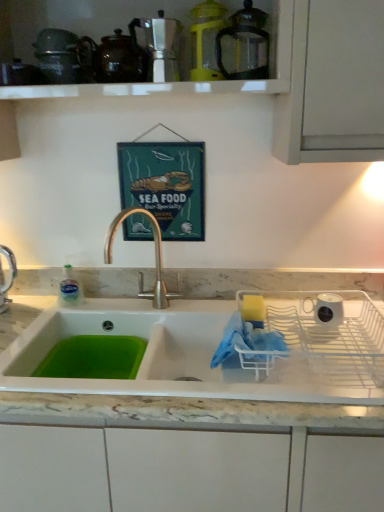
The width and height of the screenshot is (384, 512). Describe the element at coordinates (165, 185) in the screenshot. I see `teal wooden signboard at center` at that location.

Describe the element at coordinates (327, 309) in the screenshot. I see `white ceramic mug at right, the fourth appliance viewed from the top` at that location.

This screenshot has height=512, width=384. Describe the element at coordinates (158, 46) in the screenshot. I see `metallic silver coffee maker at upper center, acting as the fourth appliance starting from the right` at that location.

Where is `teal wooden signboard at center`? teal wooden signboard at center is located at coordinates (165, 185).

Is metallic silver coffee maker at upper center, arranged as the third appliance when viewed from the top, turned away from white ceramic sink at center?

No, metallic silver coffee maker at upper center, arranged as the third appliance when viewed from the top, is not facing away from white ceramic sink at center.

Considering the relative sizes of metallic silver coffee maker at upper center, which ranks as the first appliance in left-to-right order, and white ceramic sink at center in the image provided, is metallic silver coffee maker at upper center, which ranks as the first appliance in left-to-right order, thinner than white ceramic sink at center?

Yes, metallic silver coffee maker at upper center, which ranks as the first appliance in left-to-right order, is thinner than white ceramic sink at center.

In terms of height, does metallic silver coffee maker at upper center, placed as the second appliance when sorted from bottom to top, look taller or shorter compared to white ceramic sink at center?

In the image, metallic silver coffee maker at upper center, placed as the second appliance when sorted from bottom to top, appears to be shorter than white ceramic sink at center.

Is metallic silver coffee maker at upper center, placed as the second appliance when sorted from bottom to top, turned away from teal wooden signboard at center?

No, metallic silver coffee maker at upper center, placed as the second appliance when sorted from bottom to top,'s orientation is not away from teal wooden signboard at center.

Considering the relative sizes of metallic silver coffee maker at upper center, placed as the second appliance when sorted from bottom to top, and teal wooden signboard at center in the image provided, is metallic silver coffee maker at upper center, placed as the second appliance when sorted from bottom to top, bigger than teal wooden signboard at center?

Incorrect, metallic silver coffee maker at upper center, placed as the second appliance when sorted from bottom to top, is not larger than teal wooden signboard at center.

Considering the positions of objects metallic silver coffee maker at upper center, which ranks as the first appliance in left-to-right order, and teal wooden signboard at center in the image provided, who is more to the right, metallic silver coffee maker at upper center, which ranks as the first appliance in left-to-right order, or teal wooden signboard at center?

metallic silver coffee maker at upper center, which ranks as the first appliance in left-to-right order, is more to the right.

Is metallic silver coffee maker at upper center, acting as the fourth appliance starting from the right, oriented away from marble at center?

No, marble at center is not at the back of metallic silver coffee maker at upper center, acting as the fourth appliance starting from the right.

Considering the sizes of objects metallic silver coffee maker at upper center, acting as the fourth appliance starting from the right, and marble at center in the image provided, who is taller, metallic silver coffee maker at upper center, acting as the fourth appliance starting from the right, or marble at center?

With more height is marble at center.

Is metallic silver coffee maker at upper center, acting as the fourth appliance starting from the right, to the right of marble at center from the viewer's perspective?

Incorrect, metallic silver coffee maker at upper center, acting as the fourth appliance starting from the right, is not on the right side of marble at center.

Consider the image. Which of these two, metallic silver coffee maker at upper center, arranged as the third appliance when viewed from the top, or marble at center, is thinner?

With smaller width is metallic silver coffee maker at upper center, arranged as the third appliance when viewed from the top.

Based on the photo, between transparent glass carafe at upper center, which appears as the 2th appliance when viewed from the right, and metallic silver coffee maker at upper center, arranged as the third appliance when viewed from the top, which one appears on the right side from the viewer's perspective?

transparent glass carafe at upper center, which appears as the 2th appliance when viewed from the right.

From the image's perspective, between transparent glass carafe at upper center, which appears as the 2th appliance when viewed from the right, and metallic silver coffee maker at upper center, acting as the fourth appliance starting from the right, which one is located above?

From the image's view, transparent glass carafe at upper center, which appears as the 2th appliance when viewed from the right, is above.

Is transparent glass carafe at upper center, placed as the second appliance when sorted from top to bottom, further to camera compared to metallic silver coffee maker at upper center, arranged as the third appliance when viewed from the top?

No, transparent glass carafe at upper center, placed as the second appliance when sorted from top to bottom, is closer to the viewer.

From a real-world perspective, is transparent glass carafe at upper center, which is the third appliance in left-to-right order, above or below metallic silver coffee maker at upper center, acting as the fourth appliance starting from the right?

In terms of real-world spatial position, transparent glass carafe at upper center, which is the third appliance in left-to-right order, is above metallic silver coffee maker at upper center, acting as the fourth appliance starting from the right.

Considering the sizes of objects transparent glass carafe at upper center, placed as the second appliance when sorted from top to bottom, and white ceramic sink at center in the image provided, who is bigger, transparent glass carafe at upper center, placed as the second appliance when sorted from top to bottom, or white ceramic sink at center?

white ceramic sink at center.

From the image's perspective, is transparent glass carafe at upper center, which appears as the 2th appliance when viewed from the right, located above or below white ceramic sink at center?

Clearly, from the image's perspective, transparent glass carafe at upper center, which appears as the 2th appliance when viewed from the right, is above white ceramic sink at center.

Is transparent glass carafe at upper center, which appears as the 2th appliance when viewed from the right, far away from white ceramic sink at center?

No, transparent glass carafe at upper center, which appears as the 2th appliance when viewed from the right, is in close proximity to white ceramic sink at center.

Considering their positions, is transparent glass carafe at upper center, the 3th appliance ordered from the bottom, located in front of or behind white ceramic sink at center?

Visually, transparent glass carafe at upper center, the 3th appliance ordered from the bottom, is located behind white ceramic sink at center.

Where is `tea pot below the metallic silver coffee maker at upper center, acting as the fourth appliance starting from the right (from a real-world perspective)`? Image resolution: width=384 pixels, height=512 pixels. tea pot below the metallic silver coffee maker at upper center, acting as the fourth appliance starting from the right (from a real-world perspective) is located at coordinates (115, 59).

From a real-world perspective, is brown glossy teapot at upper center over metallic silver coffee maker at upper center, which ranks as the first appliance in left-to-right order?

No.

Does brown glossy teapot at upper center touch metallic silver coffee maker at upper center, which ranks as the first appliance in left-to-right order?

Absolutely, brown glossy teapot at upper center is next to and touching metallic silver coffee maker at upper center, which ranks as the first appliance in left-to-right order.

Considering the points (127, 65) and (138, 25), which point is in front, point (127, 65) or point (138, 25)?

Positioned in front is point (127, 65).

Image resolution: width=384 pixels, height=512 pixels. What are the coordinates of `picture frame behind the white ceramic mug at right, the fourth appliance viewed from the top` in the screenshot? It's located at (165, 185).

Which object is positioned more to the right, teal wooden signboard at center or white ceramic mug at right, the fourth appliance viewed from the top?

white ceramic mug at right, the fourth appliance viewed from the top, is more to the right.

Does teal wooden signboard at center lie behind white ceramic mug at right, the first appliance from the right?

Yes, teal wooden signboard at center is behind white ceramic mug at right, the first appliance from the right.

Is white ceramic mug at right, the 1th appliance ordered from the bottom, located within teal wooden signboard at center?

Actually, white ceramic mug at right, the 1th appliance ordered from the bottom, is outside teal wooden signboard at center.

At what (x,y) coordinates should I click in order to perform the action: click on appliance that is the 2nd one when counting backward from the white ceramic sink at center. Please return your answer as a coordinate pair (x, y). The image size is (384, 512). Looking at the image, I should click on (158, 46).

From a real-world perspective, count 1st appliances upward from the teal wooden signboard at center and point to it. Please provide its 2D coordinates.

[(158, 46)]

Looking at the image, which one is located further to teal wooden signboard at center, white ceramic mug at right, the 1th appliance ordered from the bottom, or marble at center?

The object further to teal wooden signboard at center is white ceramic mug at right, the 1th appliance ordered from the bottom.

Consider the image. Estimate the real-world distances between objects in this image. Which object is closer to brown glossy teapot at upper center, white ceramic sink at center or marble at center?

white ceramic sink at center is positioned closer to the anchor brown glossy teapot at upper center.

Based on the photo, from the image, which object appears to be farther from brown glossy teapot at upper center, metallic silver coffee maker at upper center, placed as the second appliance when sorted from bottom to top, or marble at center?

marble at center is further to brown glossy teapot at upper center.

Looking at the image, which one is located further to teal wooden signboard at center, marble at center or white ceramic mug at right, the first appliance from the right?

white ceramic mug at right, the first appliance from the right, lies further to teal wooden signboard at center than the other object.

Which object lies nearer to the anchor point transparent glass carafe at upper center, which appears as the 2th appliance when viewed from the right, metallic silver coffee maker at upper center, acting as the fourth appliance starting from the right, or teal wooden signboard at center?

metallic silver coffee maker at upper center, acting as the fourth appliance starting from the right, lies closer to transparent glass carafe at upper center, which appears as the 2th appliance when viewed from the right, than the other object.

From the image, which object appears to be nearer to marble at center, brown glossy teapot at upper center or white ceramic mug at right, the fourth appliance viewed from the top?

Based on the image, white ceramic mug at right, the fourth appliance viewed from the top, appears to be nearer to marble at center.

When comparing their distances from white ceramic mug at right, the first appliance from the right, does marble at center or metallic silver coffee maker at upper center, which ranks as the first appliance in left-to-right order, seem further?

metallic silver coffee maker at upper center, which ranks as the first appliance in left-to-right order.

Considering their positions, is teal wooden signboard at center positioned closer to marble at center than white ceramic mug at right, the first appliance from the right?

white ceramic mug at right, the first appliance from the right, is positioned closer to the anchor marble at center.

This screenshot has width=384, height=512. What are the coordinates of `tea pot between metallic silver coffee maker at upper center, acting as the fourth appliance starting from the right, and teal wooden signboard at center, in the vertical direction` in the screenshot? It's located at (115, 59).

Image resolution: width=384 pixels, height=512 pixels. In order to click on picture frame between yellow plastic blender at upper center, acting as the 2th appliance starting from the left, and marble at center vertically in this screenshot , I will do `click(165, 185)`.

Locate an element on the screen. sink between transparent glass carafe at upper center, the 3th appliance ordered from the bottom, and white ceramic mug at right, the 4th appliance in the left-to-right sequence, in the vertical direction is located at coordinates (213, 348).

Image resolution: width=384 pixels, height=512 pixels. Identify the location of picture frame that lies between brown glossy teapot at upper center and white ceramic sink at center from top to bottom. (165, 185).